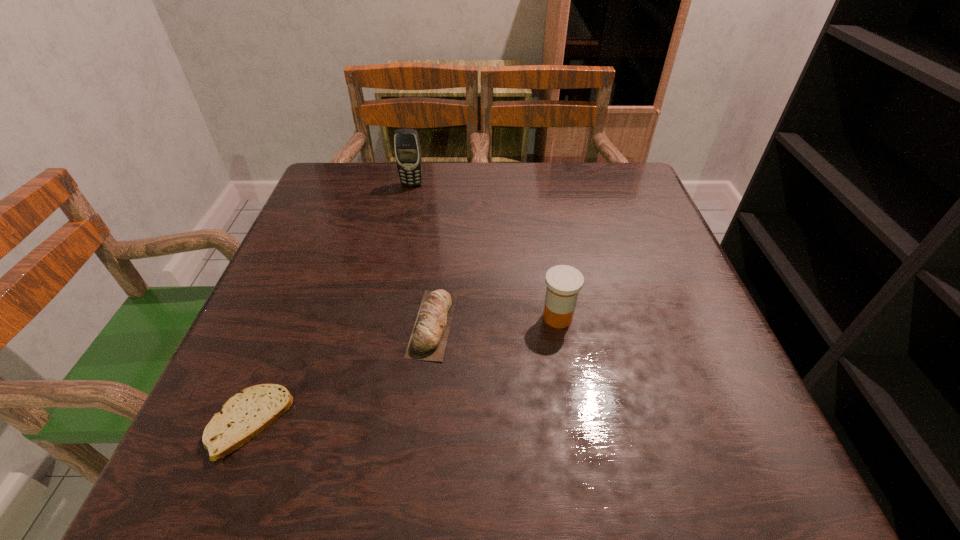
The width and height of the screenshot is (960, 540). In order to click on vacant area located 0.110m on the label of the medicine in this screenshot , I will do `click(481, 317)`.

The image size is (960, 540). Identify the location of vacant region located 0.190m on the label of the medicine. (439, 317).

What are the coordinates of `free space located on the right of the third tallest object` in the screenshot? It's located at (555, 324).

Locate an element on the screen. Image resolution: width=960 pixels, height=540 pixels. free region located on the right of the shorter pita bread is located at coordinates (386, 423).

This screenshot has height=540, width=960. What are the coordinates of `object that is at the far edge` in the screenshot? It's located at (407, 149).

You are a GUI agent. You are given a task and a screenshot of the screen. Output one action in this format:
    pyautogui.click(x=<x>, y=<y>)
    Task: Click on the object that is at the near edge
    This screenshot has width=960, height=540.
    Given the screenshot: What is the action you would take?
    pyautogui.click(x=245, y=415)

Where is `object at the left edge`? This screenshot has height=540, width=960. object at the left edge is located at coordinates (245, 415).

Find the location of a particular element. The image size is (960, 540). object positioned at the near left corner is located at coordinates (245, 415).

Locate an element on the screen. The image size is (960, 540). vacant point at the far edge is located at coordinates (541, 173).

Image resolution: width=960 pixels, height=540 pixels. Identify the location of free space at the near edge of the desktop. click(411, 450).